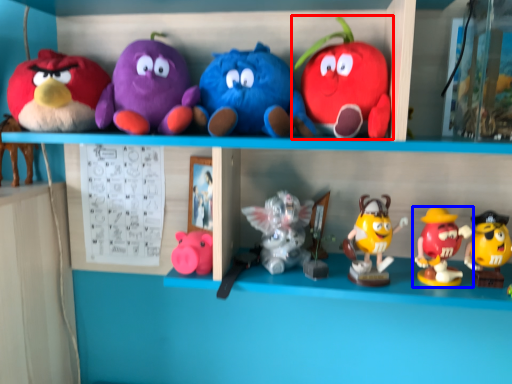
Question: Which object appears farthest to the camera in this image, toy (highlighted by a red box) or toy (highlighted by a blue box)?

Choices:
 (A) toy
 (B) toy

Answer: (B)